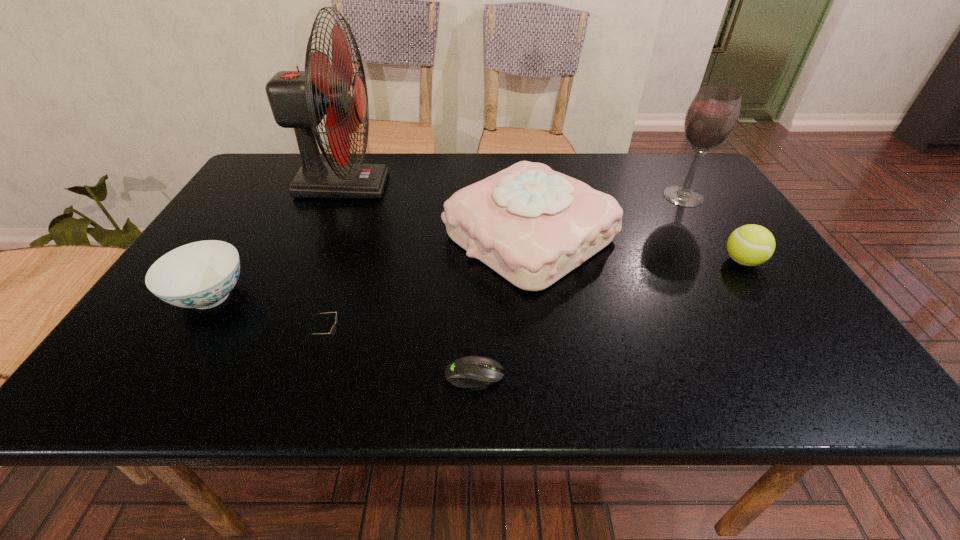
I want to click on free spot between the tennis ball and the computer mouse, so click(x=609, y=318).

At what (x,y) coordinates should I click in order to perform the action: click on free space between the third tallest object and the fan. Please return your answer as a coordinate pair (x, y). This screenshot has height=540, width=960. Looking at the image, I should click on pyautogui.click(x=436, y=211).

What are the coordinates of `vacant space that is in between the tallest object and the fifth shortest object` in the screenshot? It's located at tap(436, 211).

The image size is (960, 540). In order to click on free area in between the shortest object and the second tallest object in this screenshot , I will do `click(579, 286)`.

At what (x,y) coordinates should I click in order to perform the action: click on vacant region between the sunglasses and the computer mouse. Please return your answer as a coordinate pair (x, y). The height and width of the screenshot is (540, 960). Looking at the image, I should click on (401, 357).

This screenshot has width=960, height=540. I want to click on empty space between the cake and the computer mouse, so click(502, 306).

The width and height of the screenshot is (960, 540). I want to click on free space that is in between the sixth tallest object and the tallest object, so click(335, 262).

Locate an element on the screen. The image size is (960, 540). free space between the tennis ball and the chinaware is located at coordinates (x=476, y=279).

Image resolution: width=960 pixels, height=540 pixels. I want to click on vacant space that is in between the sunglasses and the fifth shortest object, so click(x=429, y=288).

The image size is (960, 540). I want to click on object identified as the third closest to the cake, so click(x=298, y=99).